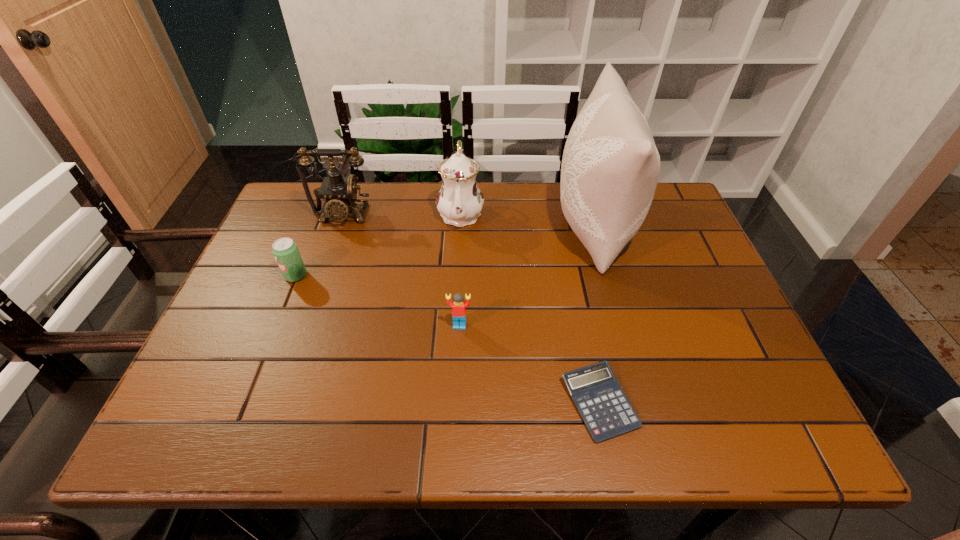
Identify the location of soda that is at the left edge. Image resolution: width=960 pixels, height=540 pixels. (285, 250).

You are a GUI agent. You are given a task and a screenshot of the screen. Output one action in this format:
    pyautogui.click(x=<x>, y=<y>)
    Task: Click on the object that is at the right edge
    This screenshot has height=540, width=960.
    Given the screenshot: What is the action you would take?
    pyautogui.click(x=610, y=167)

This screenshot has width=960, height=540. Identify the location of object that is at the far left corner. (340, 193).

Where is `object that is at the far right corner`? object that is at the far right corner is located at coordinates (610, 167).

What are the coordinates of `free space at the far edge` in the screenshot? It's located at (388, 213).

The width and height of the screenshot is (960, 540). In order to click on vacant area at the near edge in this screenshot , I will do `click(577, 427)`.

Where is `vacant region at the left edge of the desktop`? This screenshot has height=540, width=960. vacant region at the left edge of the desktop is located at coordinates (220, 392).

Find the location of a particular element. The width and height of the screenshot is (960, 540). vacant space at the right edge of the desktop is located at coordinates (665, 267).

In the image, there is a desktop. Where is `vacant space at the far left corner`? Image resolution: width=960 pixels, height=540 pixels. vacant space at the far left corner is located at coordinates (283, 211).

This screenshot has width=960, height=540. Identify the location of free region at the near left corner of the desktop. (177, 436).